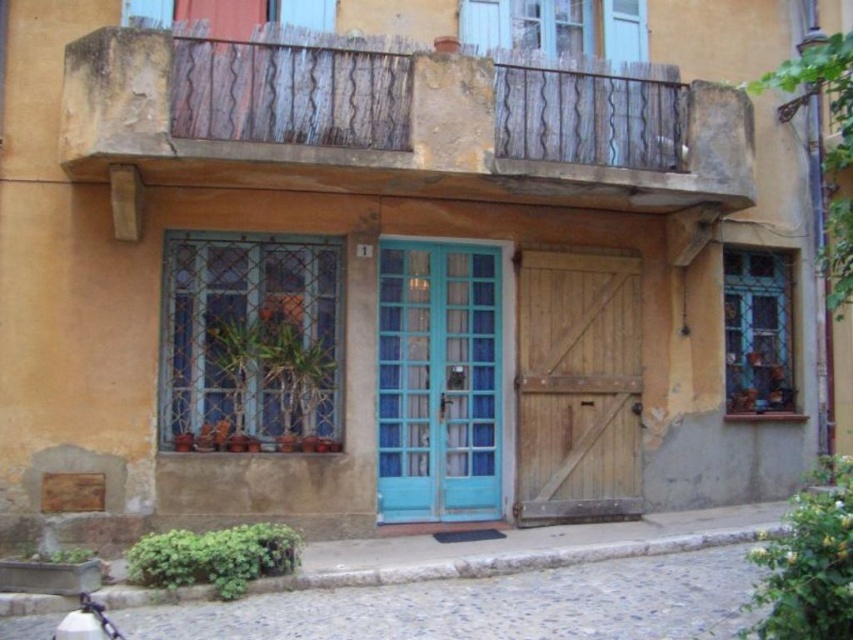
In the scene shown: You are an architect assessing the building facade. You need to determine if the weathered wood at upper center can be replaced with a new decorative panel of the same size. Can the panel fit if it is as wide as the teal glass door at center?

The weathered wood at upper center is narrower than the teal glass door at center. Since the new panel is as wide as the teal glass door at center, it would be too wide to fit in the space originally occupied by the weathered wood at upper center.

You are standing in front of the rustic building and notice two points marked on its facade. The first point is at coordinate point(428,138) and the second is at point(469,452). Which of these two points appears closer to you?

Point(428,138) is closer to the camera than point(469,452), so the first point appears closer to you.